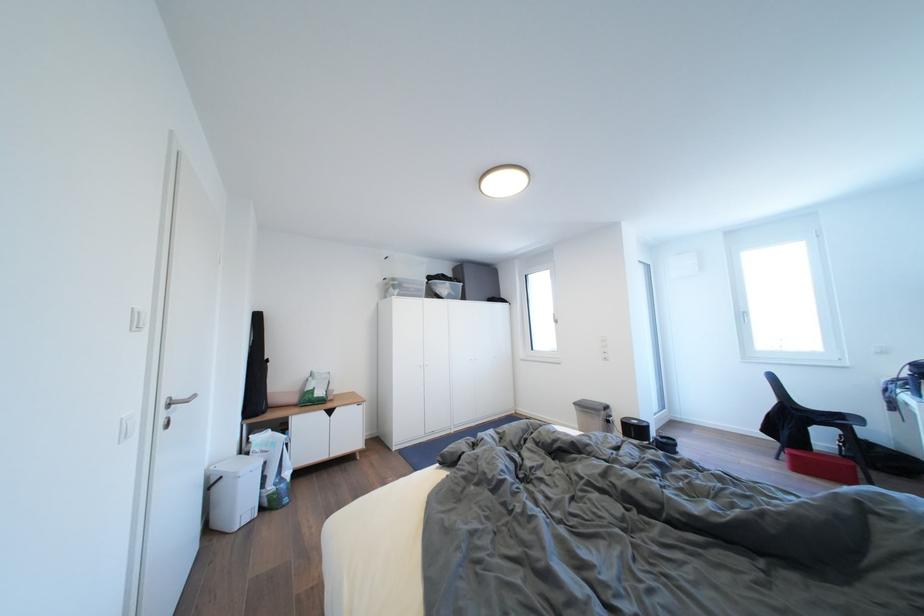
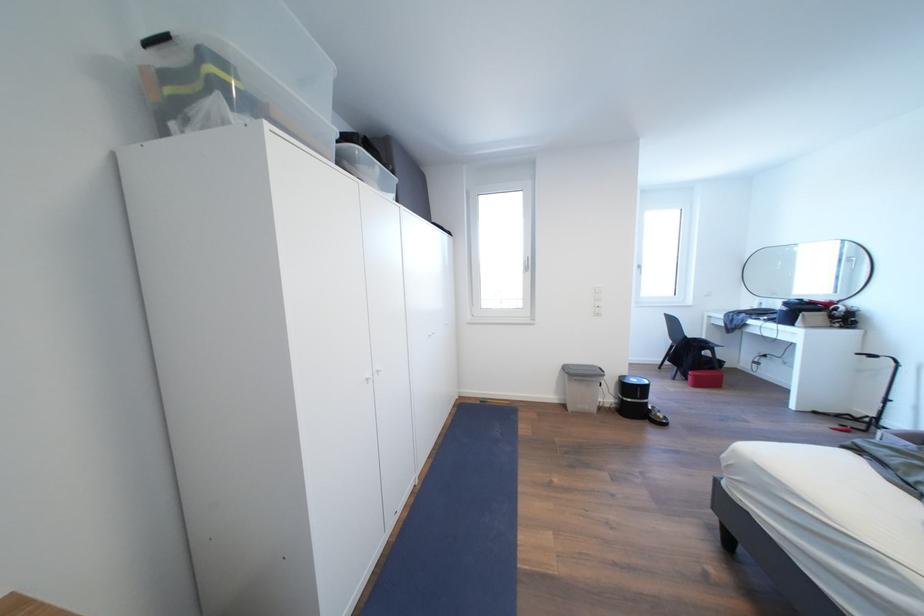
Find the pixel in the second image that matches (x=642, y=427) in the first image.

(641, 386)